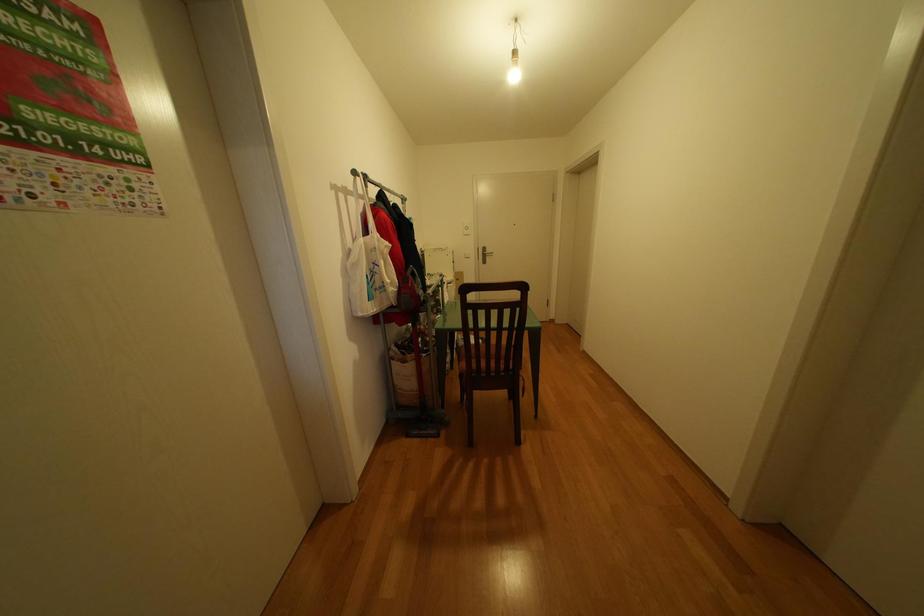
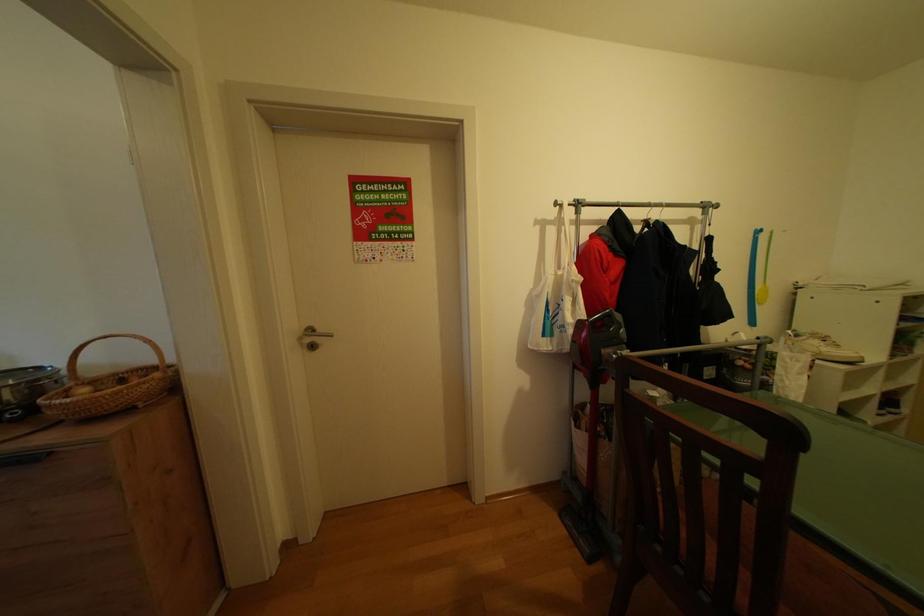
Question: How did the camera likely rotate?

Choices:
 (A) Left
 (B) Right
 (C) Up
 (D) Down

Answer: (A)